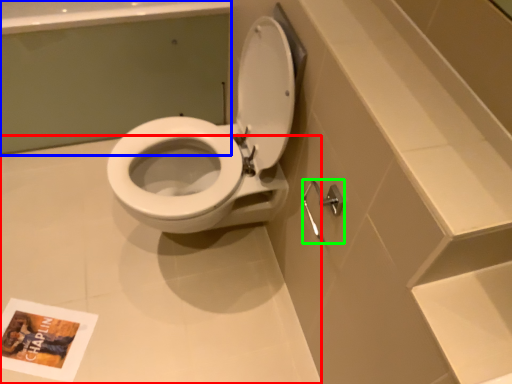
Question: Based on their relative distances, which object is farther from plain (highlighted by a red box)? Choose from bath (highlighted by a blue box) and shower (highlighted by a green box).

Choices:
 (A) bath
 (B) shower

Answer: (B)